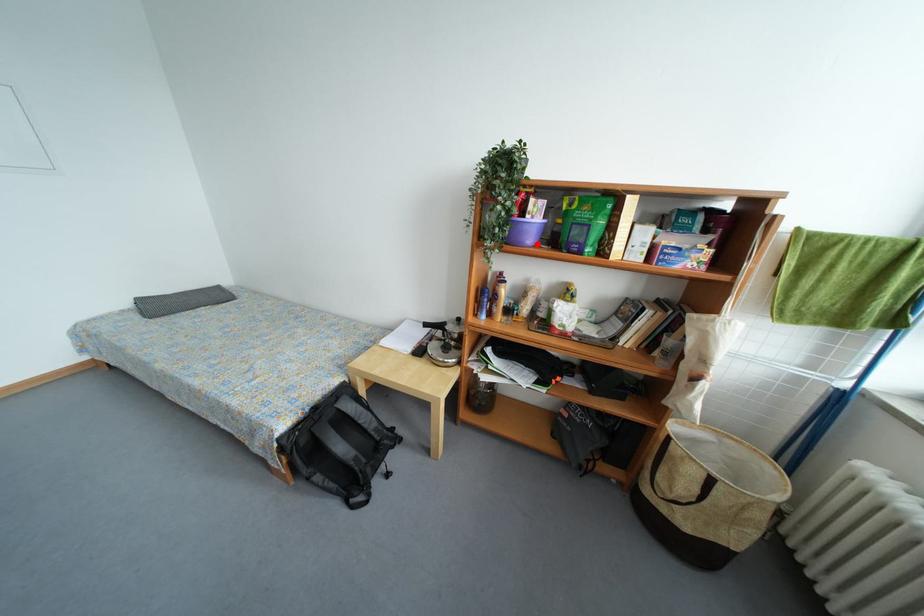
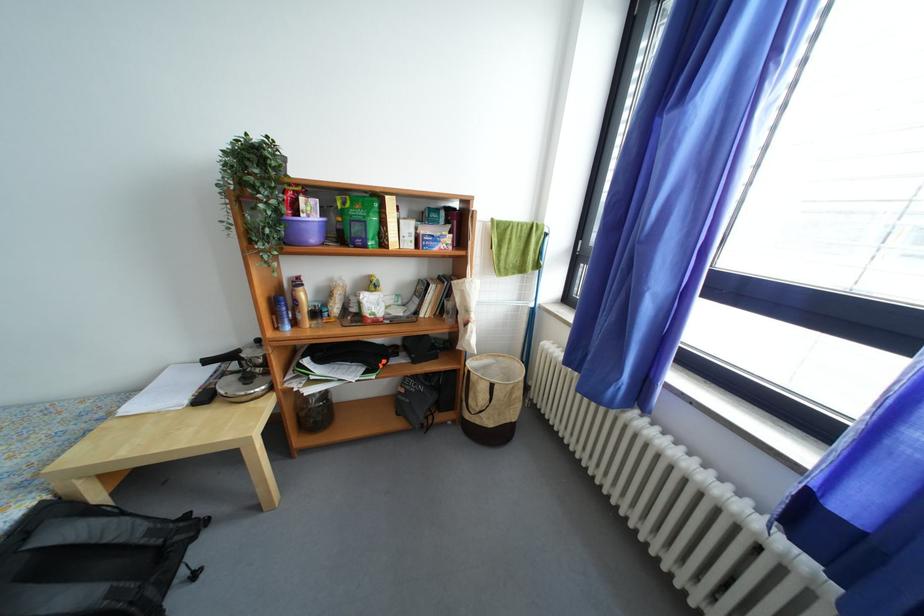
Question: I am providing you with two images of the same scene from different viewpoints. A red point is marked on the first image. Can you still see the location of the red point in image 2?

Choices:
 (A) Yes
 (B) No

Answer: (A)